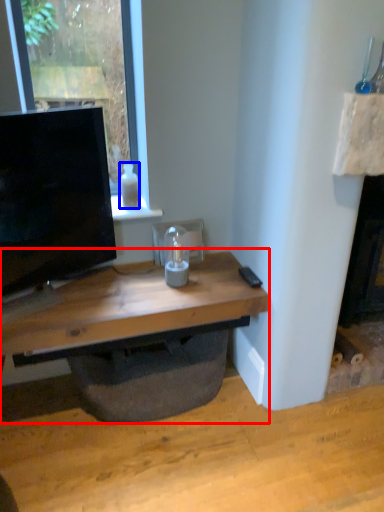
Question: Which of the following is the closest to the observer, computer desk (highlighted by a red box) or bottle (highlighted by a blue box)?

Choices:
 (A) computer desk
 (B) bottle

Answer: (A)